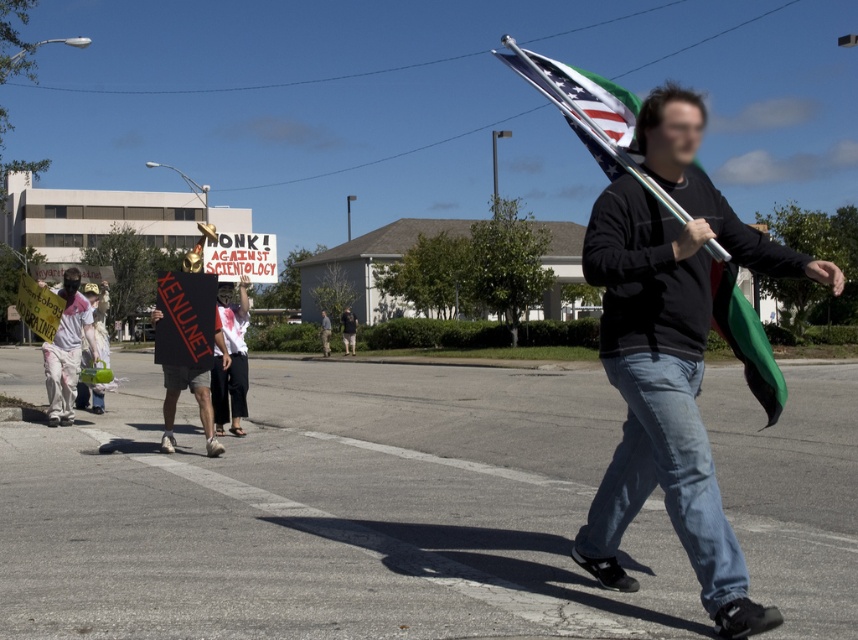
The image size is (858, 640). What do you see at coordinates (669, 355) in the screenshot?
I see `matte black shirt at center` at bounding box center [669, 355].

Who is more forward, (681,490) or (770,356)?

Positioned in front is point (681,490).

Image resolution: width=858 pixels, height=640 pixels. Identify the location of matte black shirt at center. (669, 355).

Is point (771, 369) farther from camera compared to point (76, 364)?

No.

Who is more distant from viewer, (624, 109) or (50, 374)?

Positioned behind is point (50, 374).

Who is more forward, (758, 333) or (65, 394)?

Point (758, 333) is more forward.

The width and height of the screenshot is (858, 640). What are the coordinates of `american flag at center` in the screenshot? It's located at (591, 115).

Can you confirm if matte black shirt at center is thinner than white paper sign at center?

Correct, matte black shirt at center's width is less than white paper sign at center's.

Is point (742, 630) more distant than point (59, 355)?

No.

What are the coordinates of `matte black shirt at center` in the screenshot? It's located at (669, 355).

The image size is (858, 640). Find the location of `matte black shirt at center`. matte black shirt at center is located at coordinates (669, 355).